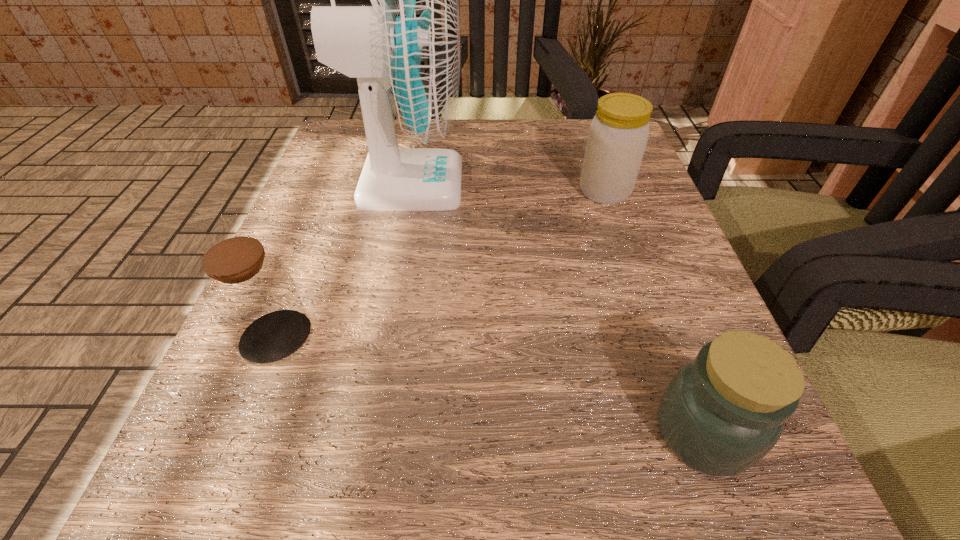
The width and height of the screenshot is (960, 540). Identify the location of free space that satisfies the following two spatial constraints: 1. in front of the fan to face the airflow; 2. on the back side of the farthest jar. (407, 191).

You are a GUI agent. You are given a task and a screenshot of the screen. Output one action in this format:
    pyautogui.click(x=<x>, y=<y>)
    Task: Click on the free space that satisfies the following two spatial constraints: 1. in front of the farthest jar to face the airflow; 2. on the left side of the fan
    This screenshot has width=960, height=540.
    Given the screenshot: What is the action you would take?
    pos(407,191)